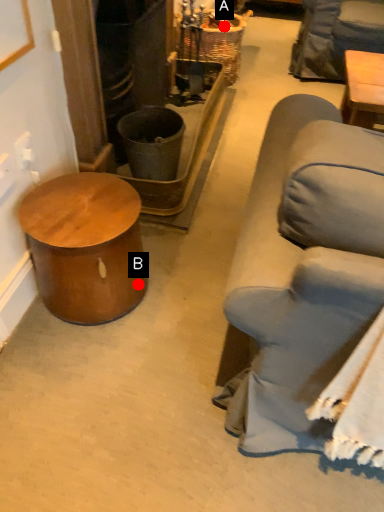
Question: Two points are circled on the image, labeled by A and B beside each circle. Which of the following is the farthest from the observer?

Choices:
 (A) A is further
 (B) B is further

Answer: (A)